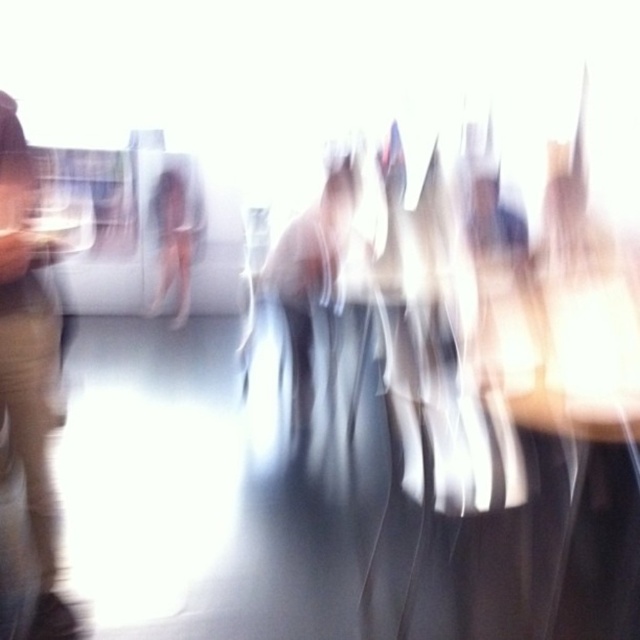
Is light beige pants at left to the left of translucent white figure at center from the viewer's perspective?

→ Incorrect, light beige pants at left is not on the left side of translucent white figure at center.

What do you see at coordinates (28, 369) in the screenshot?
I see `light beige pants at left` at bounding box center [28, 369].

The width and height of the screenshot is (640, 640). I want to click on light beige pants at left, so click(28, 369).